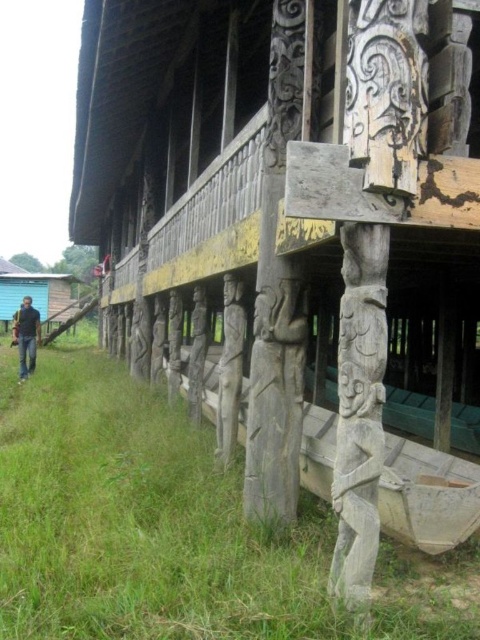
Question: Which point appears farthest from the camera in this image?

Choices:
 (A) (241, 355)
 (B) (31, 328)

Answer: (B)

Question: Which point is farther to the camera?

Choices:
 (A) (4, 300)
 (B) (238, 374)
 (C) (227, 209)
 (D) (31, 307)

Answer: (A)

Question: Can you confirm if weathered wood hut at lower center is positioned above wooden canoe at lower center?

Choices:
 (A) yes
 (B) no

Answer: (A)

Question: Does green grass at lower center appear on the right side of blue painted wood hut at lower left?

Choices:
 (A) yes
 (B) no

Answer: (A)

Question: Can you confirm if wooden canoe at lower center is thinner than dark blue jeans at lower left?

Choices:
 (A) no
 (B) yes

Answer: (B)

Question: Based on their relative distances, which object is farther from the dark blue jeans at lower left?

Choices:
 (A) green grass at lower center
 (B) weathered wood hut at lower center
 (C) blue painted wood hut at lower left

Answer: (C)